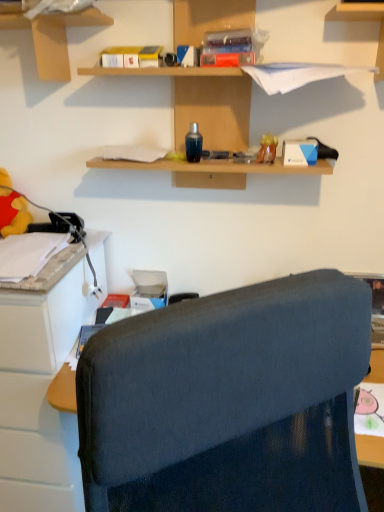
Question: Are wooden shelves at upper center, which is counted as the second shelf, starting from the left, and matte cardboard box at upper left, arranged as the 1th shelf when viewed from the left, located far from each other?

Choices:
 (A) yes
 (B) no

Answer: (B)

Question: Is wooden shelves at upper center, which is counted as the second shelf, starting from the left, shorter than matte cardboard box at upper left, arranged as the 1th shelf when viewed from the left?

Choices:
 (A) yes
 (B) no

Answer: (B)

Question: Is wooden shelves at upper center, acting as the first shelf starting from the right, aimed at matte cardboard box at upper left, arranged as the 1th shelf when viewed from the left?

Choices:
 (A) yes
 (B) no

Answer: (B)

Question: Can you confirm if wooden shelves at upper center, which is counted as the second shelf, starting from the left, is taller than matte cardboard box at upper left, arranged as the 1th shelf when viewed from the left?

Choices:
 (A) yes
 (B) no

Answer: (A)

Question: From a real-world perspective, is wooden shelves at upper center, which is counted as the second shelf, starting from the left, beneath matte cardboard box at upper left, arranged as the 1th shelf when viewed from the left?

Choices:
 (A) no
 (B) yes

Answer: (B)

Question: Is yellow plush toy at left, the second toy when ordered from right to left, bigger or smaller than matte plastic toy at upper right, the 1th toy positioned from the right?

Choices:
 (A) small
 (B) big

Answer: (B)

Question: Is point (8, 193) closer or farther from the camera than point (264, 155)?

Choices:
 (A) farther
 (B) closer

Answer: (A)

Question: Looking at their shapes, would you say yellow plush toy at left, marked as the 1th toy in a back-to-front arrangement, is wider or thinner than matte plastic toy at upper right, the 1th toy positioned from the right?

Choices:
 (A) thin
 (B) wide

Answer: (B)

Question: From their relative heights in the image, would you say yellow plush toy at left, the second toy when ordered from right to left, is taller or shorter than matte plastic toy at upper right, the 1th toy positioned from the right?

Choices:
 (A) short
 (B) tall

Answer: (B)

Question: Is matte cardboard box at upper left, arranged as the 1th shelf when viewed from the left, in front of or behind yellow plush toy at left, marked as the 1th toy in a left-to-right arrangement, in the image?

Choices:
 (A) behind
 (B) front

Answer: (B)

Question: Considering the positions of matte cardboard box at upper left, placed as the second shelf when sorted from right to left, and yellow plush toy at left, the second toy when ordered from right to left, in the image, is matte cardboard box at upper left, placed as the second shelf when sorted from right to left, wider or thinner than yellow plush toy at left, the second toy when ordered from right to left,?

Choices:
 (A) thin
 (B) wide

Answer: (B)

Question: Looking at the image, does matte cardboard box at upper left, arranged as the 1th shelf when viewed from the left, seem bigger or smaller compared to yellow plush toy at left, marked as the 1th toy in a back-to-front arrangement?

Choices:
 (A) big
 (B) small

Answer: (A)

Question: Considering the positions of matte cardboard box at upper left, arranged as the 1th shelf when viewed from the left, and yellow plush toy at left, marked as the 1th toy in a left-to-right arrangement, in the image, is matte cardboard box at upper left, arranged as the 1th shelf when viewed from the left, taller or shorter than yellow plush toy at left, marked as the 1th toy in a left-to-right arrangement,?

Choices:
 (A) short
 (B) tall

Answer: (A)

Question: Does point (21, 19) appear closer or farther from the camera than point (205, 79)?

Choices:
 (A) farther
 (B) closer

Answer: (B)

Question: Is matte cardboard box at upper left, arranged as the 1th shelf when viewed from the left, inside the boundaries of wooden shelves at upper center, which is counted as the second shelf, starting from the left, or outside?

Choices:
 (A) inside
 (B) outside

Answer: (B)